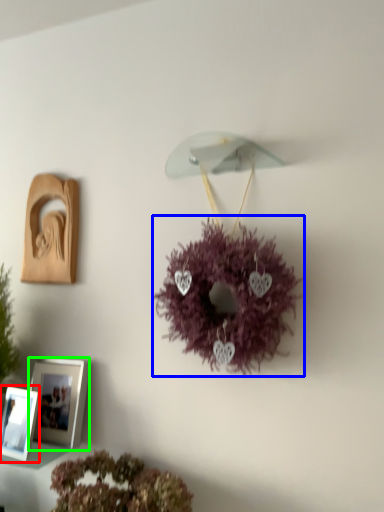
Question: Which is nearer to the picture frame (highlighted by a red box)? flower (highlighted by a blue box) or picture frame (highlighted by a green box).

Choices:
 (A) flower
 (B) picture frame

Answer: (B)